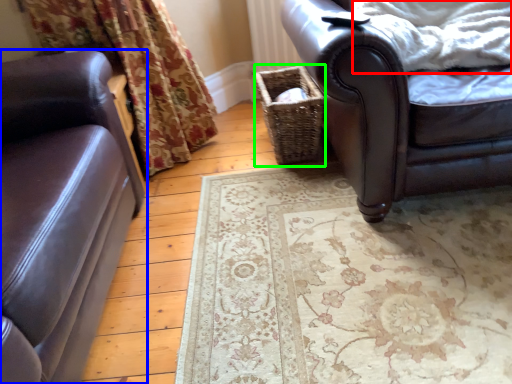
Question: Which is farther away from blanket (highlighted by a red box)? studio couch (highlighted by a blue box) or basket (highlighted by a green box)?

Choices:
 (A) studio couch
 (B) basket

Answer: (A)